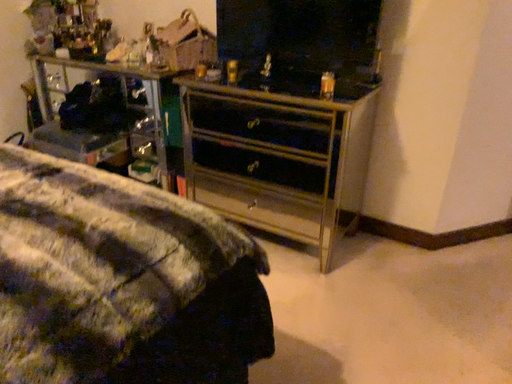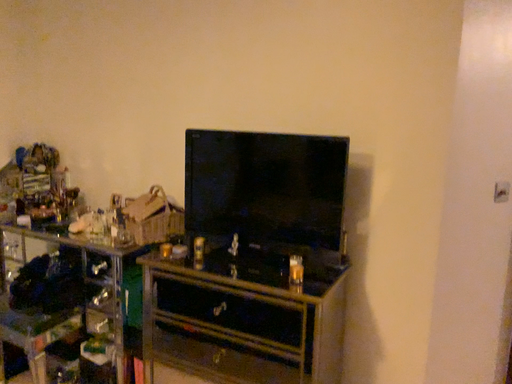
Question: How did the camera likely rotate when shooting the video?

Choices:
 (A) rotated upward
 (B) rotated downward

Answer: (A)